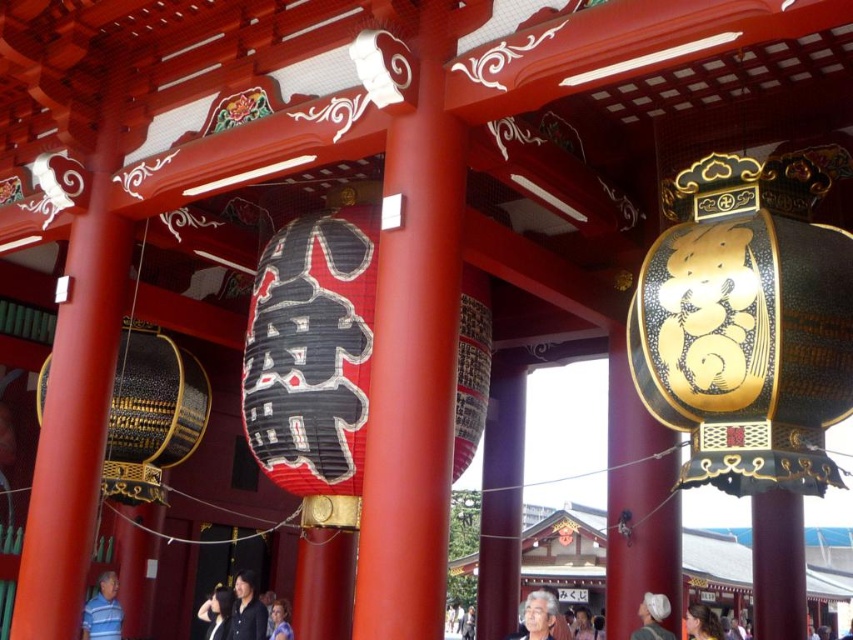
Does gold textured lantern at center have a greater height compared to white fabric cap at lower center?

Indeed, gold textured lantern at center has a greater height compared to white fabric cap at lower center.

Does gold textured lantern at center have a lesser height compared to white fabric cap at lower center?

No.

Between point (160, 369) and point (653, 604), which one is positioned in front?

Point (653, 604)

The height and width of the screenshot is (640, 853). I want to click on gold textured lantern at center, so click(x=151, y=413).

Between point (786, 282) and point (318, 225), which one is positioned in front?

Point (786, 282)

Which is below, black-golden textured lantern at center-right or black paper lantern at center?

Positioned lower is black paper lantern at center.

Locate an element on the screen. The height and width of the screenshot is (640, 853). black-golden textured lantern at center-right is located at coordinates tap(746, 348).

Locate an element on the screen. black-golden textured lantern at center-right is located at coordinates (746, 348).

Does blue striped shirt at lower left come behind matte black shirt at center?

No, it is not.

Measure the distance between point (100, 628) and camera.

A distance of 9.37 meters exists between point (100, 628) and camera.

Which is behind, point (96, 595) or point (219, 588)?

Point (219, 588)

The width and height of the screenshot is (853, 640). What are the coordinates of `blue striped shirt at lower left` in the screenshot? It's located at (103, 611).